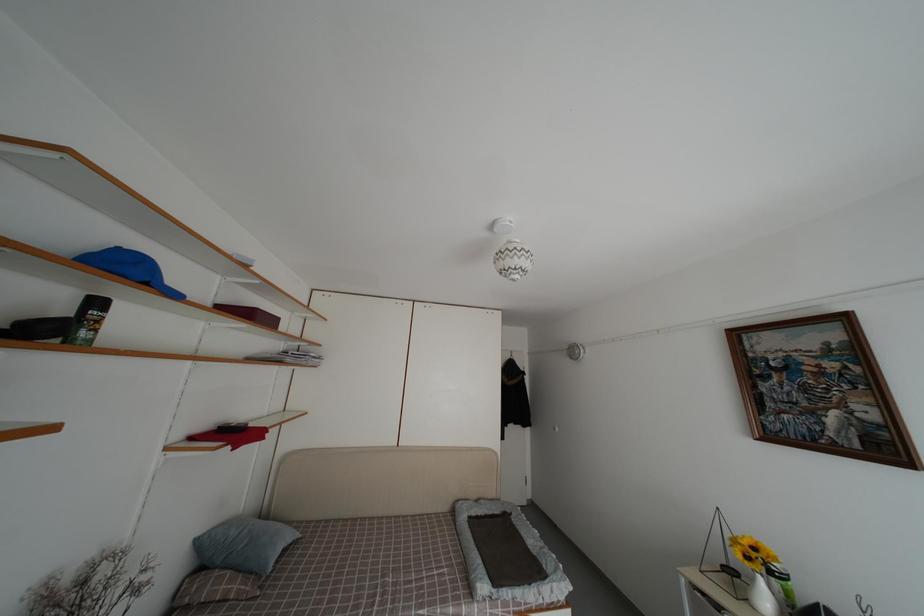
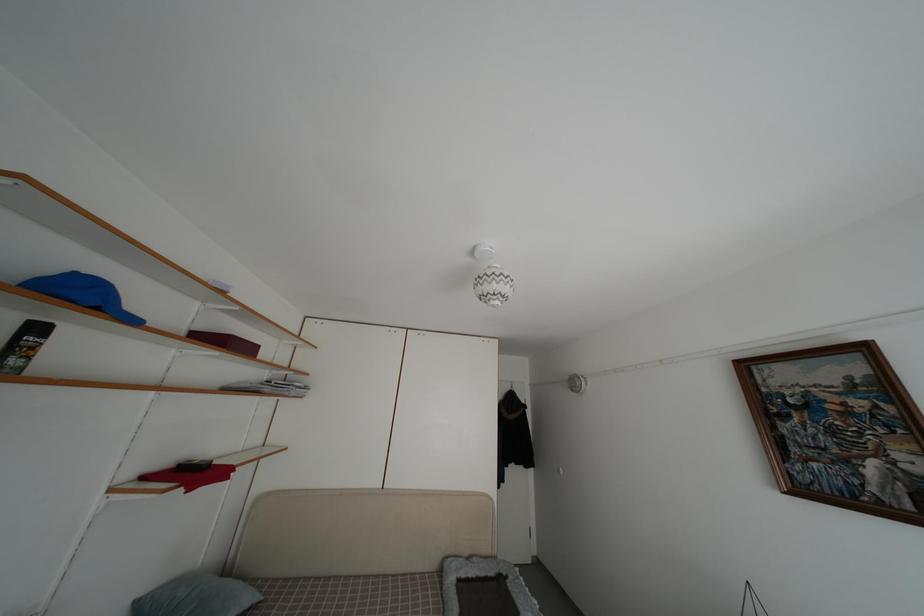
Locate, in the second image, the point that corresponds to the point at 125,254 in the first image.

(81, 280)